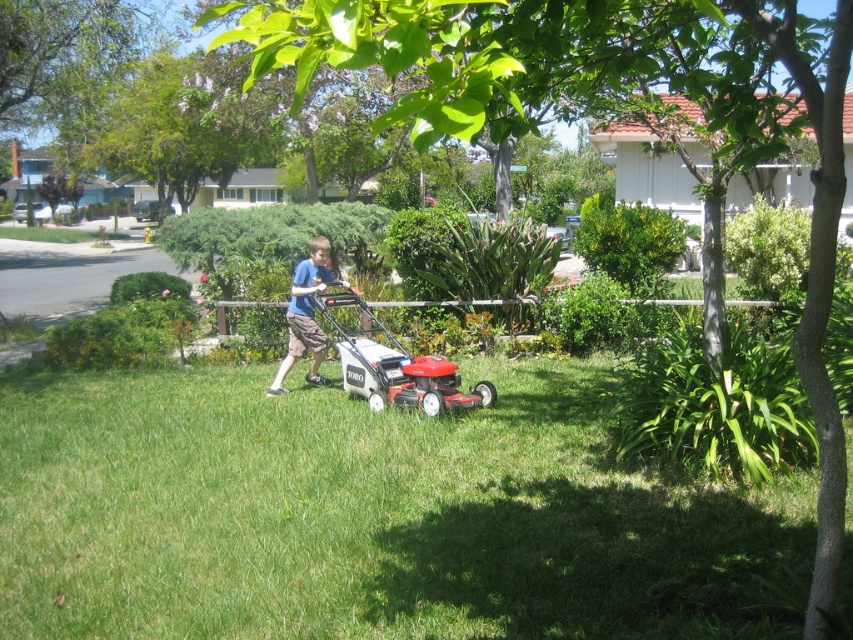
Question: Observing the image, what is the correct spatial positioning of green grass at center in reference to blue cotton shirt at center?

Choices:
 (A) left
 (B) right

Answer: (A)

Question: Which point appears closest to the camera in this image?

Choices:
 (A) (471, 492)
 (B) (328, 243)

Answer: (A)

Question: From the image, what is the correct spatial relationship of green grass at center in relation to blue cotton shirt at center?

Choices:
 (A) right
 (B) left

Answer: (B)

Question: In this image, where is green grass at center located relative to blue cotton shirt at center?

Choices:
 (A) above
 (B) below

Answer: (B)

Question: Which point is farther to the camera?

Choices:
 (A) (274, 380)
 (B) (109, 493)

Answer: (A)